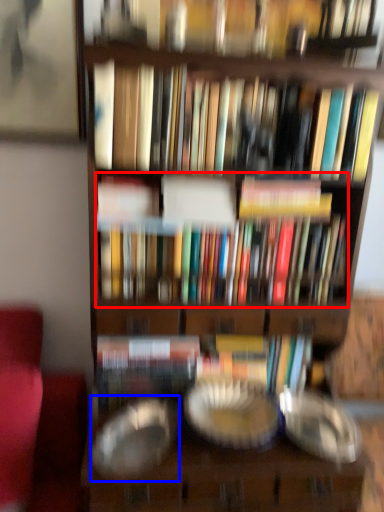
Question: Among these objects, which one is farthest to the camera, book (highlighted by a red box) or glass plate (highlighted by a blue box)?

Choices:
 (A) book
 (B) glass plate

Answer: (A)